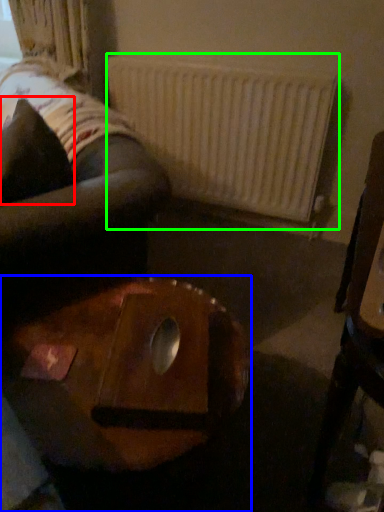
Question: Estimate the real-world distances between objects in this image. Which object is farther from pillow (highlighted by a red box), table (highlighted by a blue box) or radiator (highlighted by a green box)?

Choices:
 (A) table
 (B) radiator

Answer: (B)